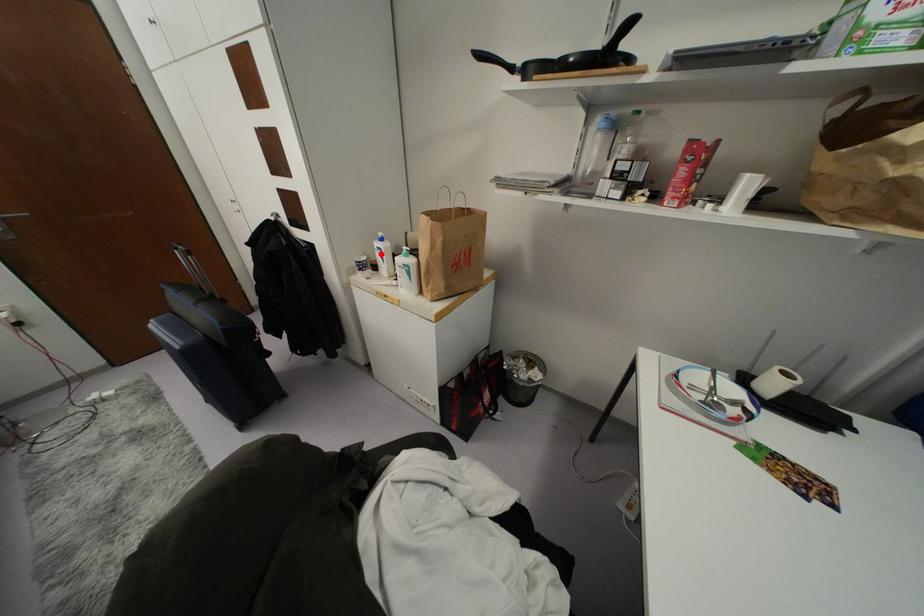
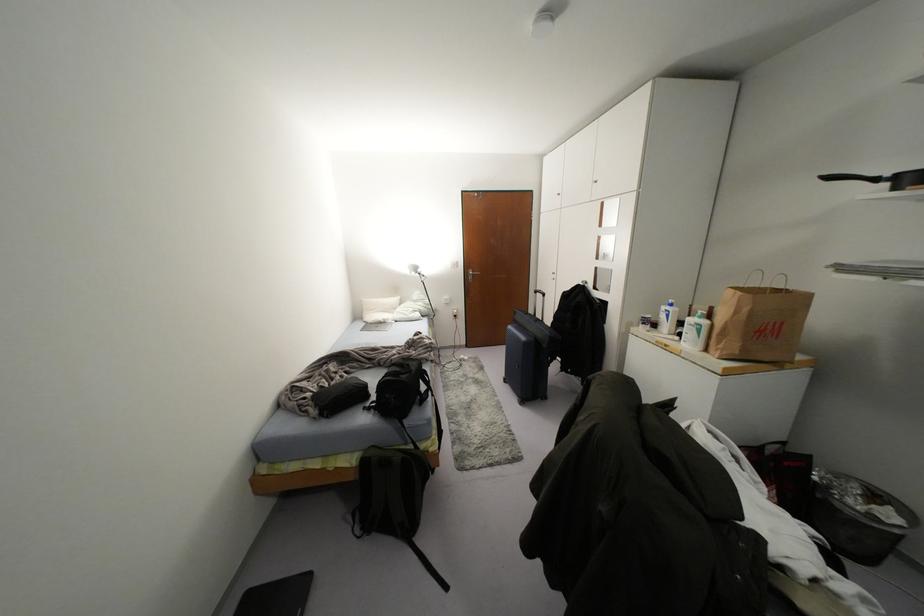
Where in the second image is the point corresponding to the highlighted location from the first image?

(666, 315)